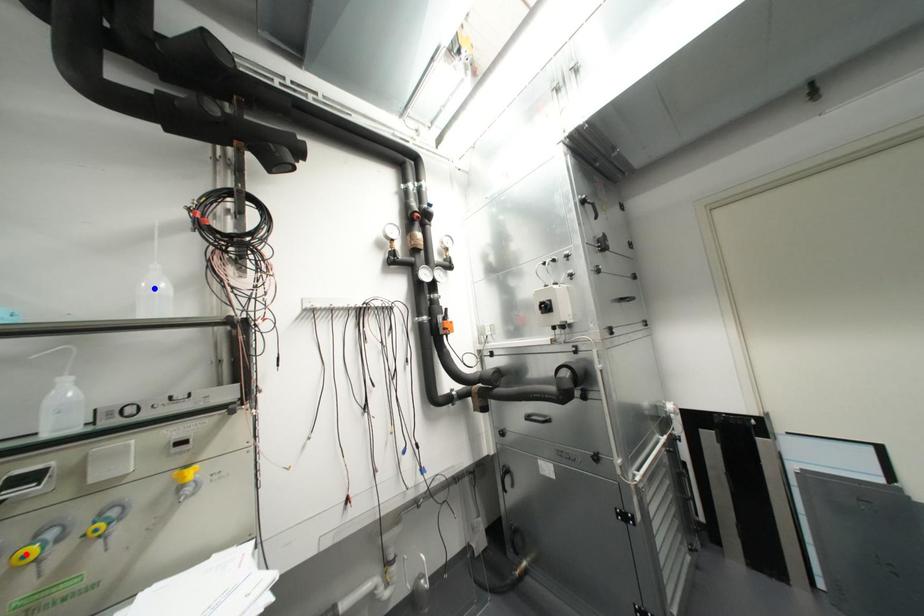
Question: Two points are marked on the image. Which point is closer to the camera?

Choices:
 (A) Blue point is closer.
 (B) Red point is closer.

Answer: (B)